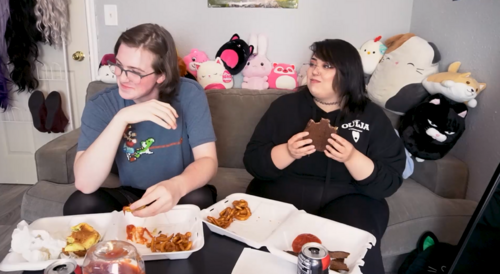
Find the location of a particular element. stuffed animal is located at coordinates (242, 60), (216, 83), (198, 55), (287, 75), (258, 79), (409, 57), (368, 53), (467, 78), (442, 124).